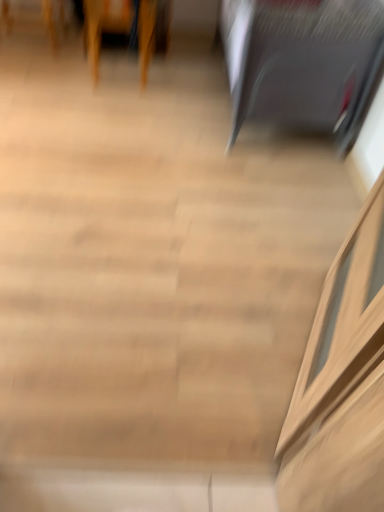
Question: Can you confirm if wooden chair at upper left, which is counted as the first furniture, starting from the left, is smaller than satin black laptop at upper right, the 2th furniture viewed from the left?

Choices:
 (A) no
 (B) yes

Answer: (B)

Question: From a real-world perspective, does wooden chair at upper left, which is counted as the first furniture, starting from the left, sit lower than satin black laptop at upper right, the 2th furniture viewed from the left?

Choices:
 (A) no
 (B) yes

Answer: (B)

Question: Could you tell me if wooden chair at upper left, the second furniture viewed from the right, is facing satin black laptop at upper right, the 1th furniture viewed from the right?

Choices:
 (A) no
 (B) yes

Answer: (A)

Question: Is wooden chair at upper left, the second furniture viewed from the right, wider than satin black laptop at upper right, the 2th furniture viewed from the left?

Choices:
 (A) yes
 (B) no

Answer: (B)

Question: Does wooden chair at upper left, which is counted as the first furniture, starting from the left, have a lesser width compared to satin black laptop at upper right, the 2th furniture viewed from the left?

Choices:
 (A) no
 (B) yes

Answer: (B)

Question: From the image's perspective, is wooden chair at upper left, the second furniture viewed from the right, on satin black laptop at upper right, the 2th furniture viewed from the left?

Choices:
 (A) yes
 (B) no

Answer: (A)

Question: Is wooden chair at upper left, the second furniture viewed from the right, surrounded by satin black laptop at upper right, the 1th furniture viewed from the right?

Choices:
 (A) yes
 (B) no

Answer: (B)

Question: Does satin black laptop at upper right, the 1th furniture viewed from the right, have a larger size compared to wooden chair at upper left, which is counted as the first furniture, starting from the left?

Choices:
 (A) no
 (B) yes

Answer: (B)

Question: From the image's perspective, is satin black laptop at upper right, the 1th furniture viewed from the right, under wooden chair at upper left, which is counted as the first furniture, starting from the left?

Choices:
 (A) yes
 (B) no

Answer: (A)

Question: Considering the relative sizes of satin black laptop at upper right, the 2th furniture viewed from the left, and wooden chair at upper left, the second furniture viewed from the right, in the image provided, is satin black laptop at upper right, the 2th furniture viewed from the left, shorter than wooden chair at upper left, the second furniture viewed from the right,?

Choices:
 (A) yes
 (B) no

Answer: (B)

Question: Is satin black laptop at upper right, the 2th furniture viewed from the left, located outside wooden chair at upper left, which is counted as the first furniture, starting from the left?

Choices:
 (A) yes
 (B) no

Answer: (A)

Question: Can you confirm if satin black laptop at upper right, the 2th furniture viewed from the left, is positioned to the left of wooden chair at upper left, which is counted as the first furniture, starting from the left?

Choices:
 (A) no
 (B) yes

Answer: (A)

Question: Looking at their shapes, would you say satin black laptop at upper right, the 1th furniture viewed from the right, is wider or thinner than wooden chair at upper left, the second furniture viewed from the right?

Choices:
 (A) wide
 (B) thin

Answer: (A)